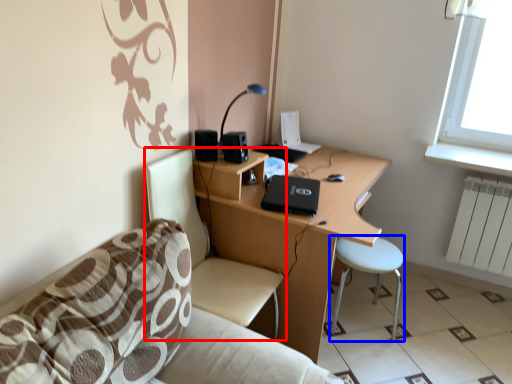
Question: Among these objects, which one is farthest to the camera, chair (highlighted by a red box) or bar stool (highlighted by a blue box)?

Choices:
 (A) chair
 (B) bar stool

Answer: (B)